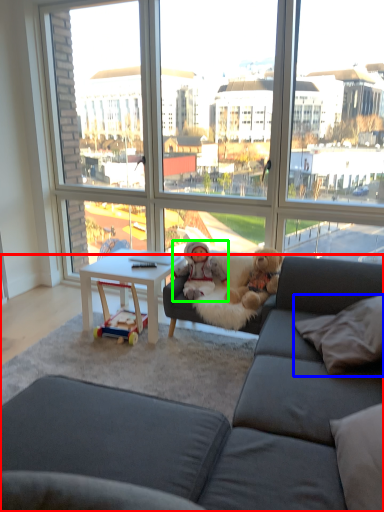
Question: Considering the real-world distances, which object is farthest from studio couch (highlighted by a red box)? pillow (highlighted by a blue box) or person (highlighted by a green box)?

Choices:
 (A) pillow
 (B) person

Answer: (B)